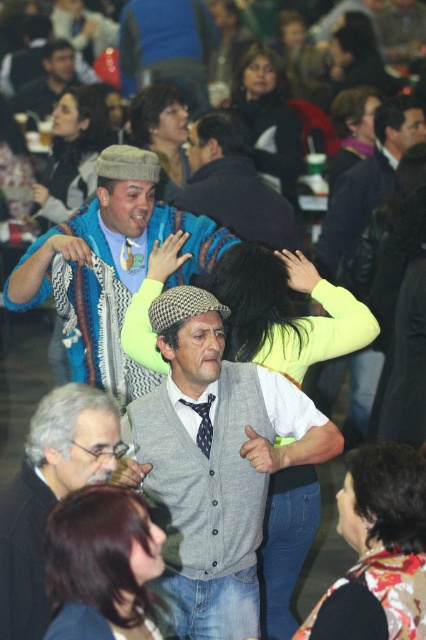
You are standing at the camera position and want to grab the knitted sweater at center. Can you reach it without moving your feet?

The knitted sweater at center is 4.51 meters from camera, so no, you cannot reach it without moving your feet since it is too far away.